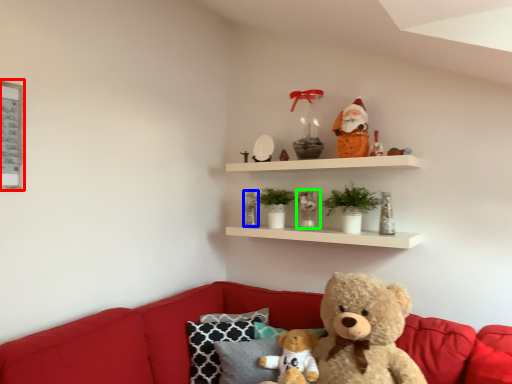
Question: Which object is positioned closest to picture frame (highlighted by a red box)? Select from toy (highlighted by a blue box) and toy (highlighted by a green box).

Choices:
 (A) toy
 (B) toy

Answer: (A)